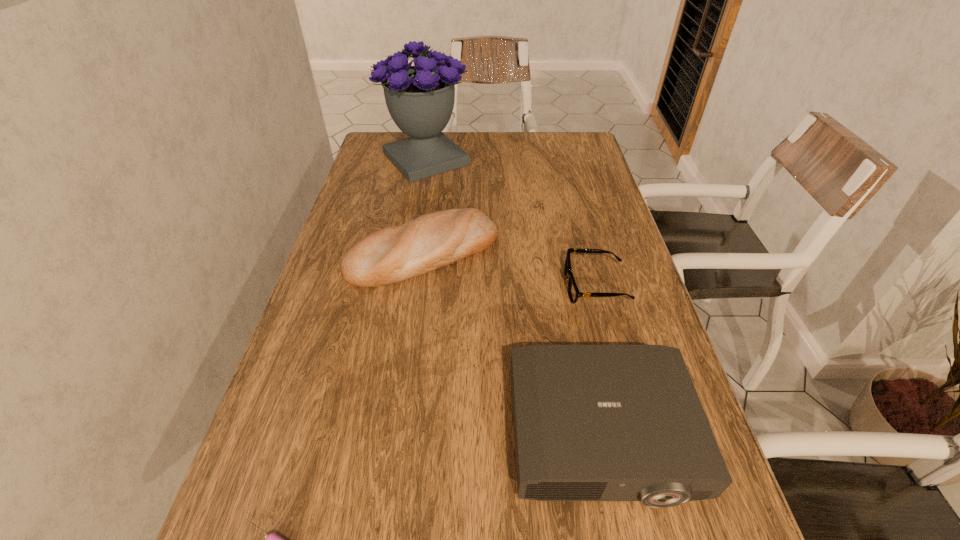
Locate an element on the screen. bouquet is located at coordinates (420, 99).

This screenshot has height=540, width=960. Find the location of `the farthest object`. the farthest object is located at coordinates (420, 99).

Where is `projector`? This screenshot has width=960, height=540. projector is located at coordinates (591, 422).

Where is `bread`? The image size is (960, 540). bread is located at coordinates (393, 254).

You are a GUI agent. You are given a task and a screenshot of the screen. Output one action in this format:
    pyautogui.click(x=<x>, y=<y>)
    Task: Click on the sunglasses
    Image resolution: width=960 pixels, height=540 pixels.
    Given the screenshot: What is the action you would take?
    pyautogui.click(x=573, y=291)

I want to click on vacant space located 0.260m on the right of the farthest object, so click(547, 159).

Locate an element on the screen. vacant space located 0.380m on the back of the bread is located at coordinates (438, 154).

This screenshot has width=960, height=540. I want to click on free space located on the front-facing side of the sunglasses, so click(x=522, y=286).

The height and width of the screenshot is (540, 960). In order to click on free space located 0.250m on the front-facing side of the sunglasses in this screenshot , I will do `click(459, 286)`.

You are a GUI agent. You are given a task and a screenshot of the screen. Output one action in this format:
    pyautogui.click(x=<x>, y=<y>)
    Task: Click on the blank space located on the front-facing side of the sunglasses
    The image size is (960, 540).
    Given the screenshot: What is the action you would take?
    click(485, 286)